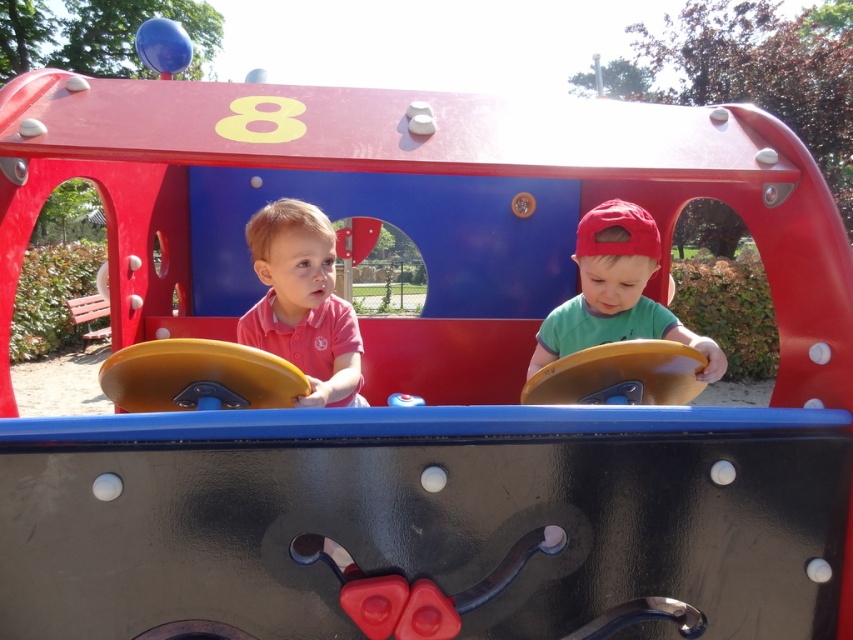
Is matte pink shirt at center above green matte shirt at center?

No.

This screenshot has height=640, width=853. In order to click on matte pink shirt at center in this screenshot , I will do `click(302, 301)`.

The width and height of the screenshot is (853, 640). What are the coordinates of `matte pink shirt at center` in the screenshot? It's located at (302, 301).

This screenshot has height=640, width=853. I want to click on matte pink shirt at center, so click(302, 301).